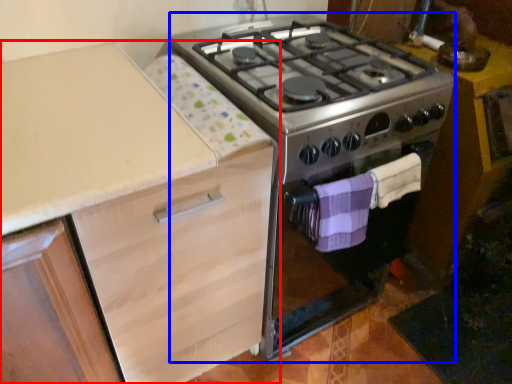
Question: Which object appears farthest to the camera in this image, cabinetry (highlighted by a red box) or appliance (highlighted by a blue box)?

Choices:
 (A) cabinetry
 (B) appliance

Answer: (B)